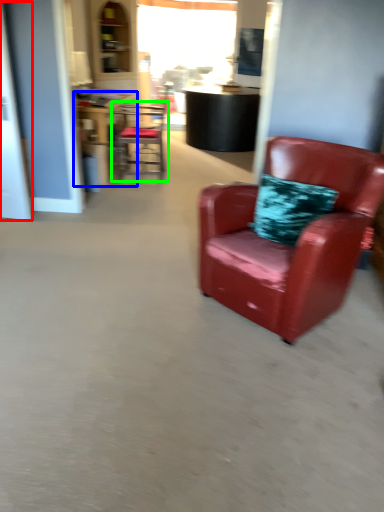
Question: Estimate the real-world distances between objects in this image. Which object is closer to glass door (highlighted by a red box), table (highlighted by a blue box) or chair (highlighted by a green box)?

Choices:
 (A) table
 (B) chair

Answer: (A)